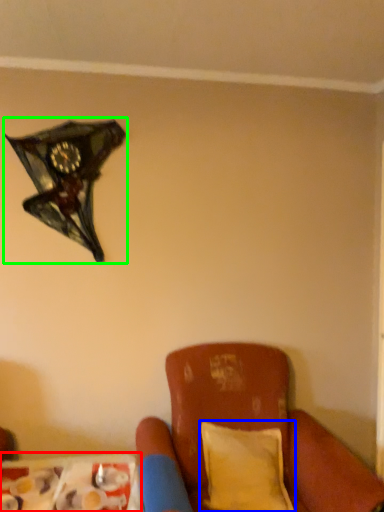
Question: Which object is the closest to the table (highlighted by a red box)? Choose among these: pillow (highlighted by a blue box) or lamp (highlighted by a green box).

Choices:
 (A) pillow
 (B) lamp

Answer: (A)